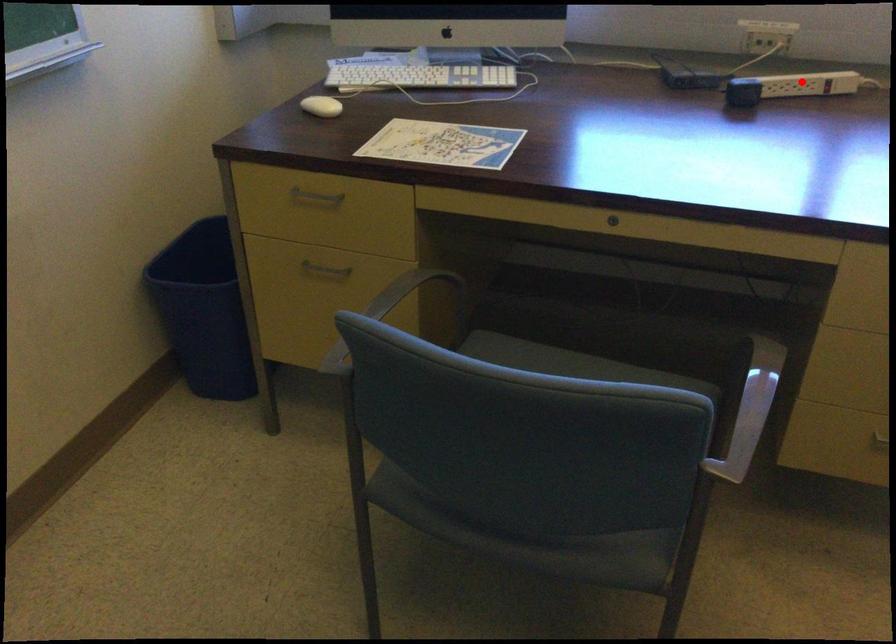
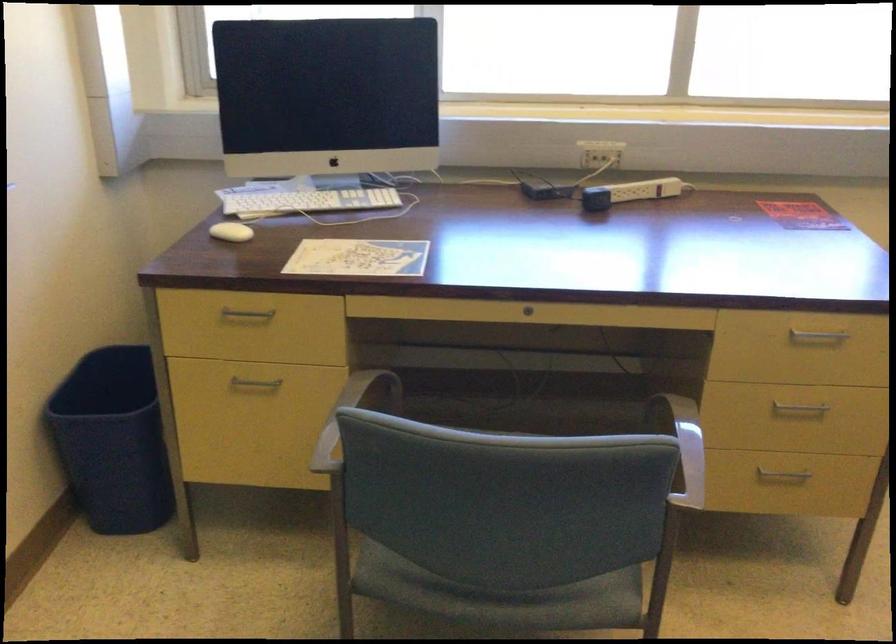
Question: I am providing you with two images of the same scene from different viewpoints. Image1 has a red point marked. In image2, the corresponding 3D location appears at what relative position? Reply with the corresponding letter.

Choices:
 (A) Closer
 (B) Farther

Answer: (B)